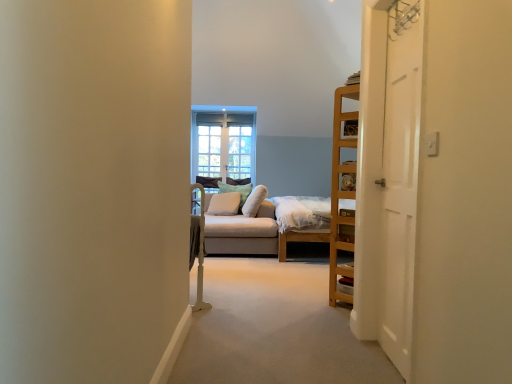
Question: From their relative heights in the image, would you say clear glass window at center is taller or shorter than light gray fabric studio couch at center?

Choices:
 (A) short
 (B) tall

Answer: (B)

Question: Is clear glass window at center wider or thinner than light gray fabric studio couch at center?

Choices:
 (A) thin
 (B) wide

Answer: (A)

Question: Which object is positioned closest to the clear glass window at center?

Choices:
 (A) soft white cushion at center, which ranks as the 3th pillow in left-to-right order
 (B) green fabric pillow at center, placed as the second pillow when sorted from right to left
 (C) white wooden door at right
 (D) light gray fabric studio couch at center
 (E) light green textured pillow at center, which is counted as the first pillow, starting from the left

Answer: (B)

Question: Estimate the real-world distances between objects in this image. Which object is farther from the light gray fabric studio couch at center?

Choices:
 (A) light green textured pillow at center, which is counted as the first pillow, starting from the left
 (B) green fabric pillow at center, placed as the second pillow when sorted from right to left
 (C) white wooden door at right
 (D) soft white cushion at center, which ranks as the 3th pillow in left-to-right order
 (E) clear glass window at center

Answer: (C)